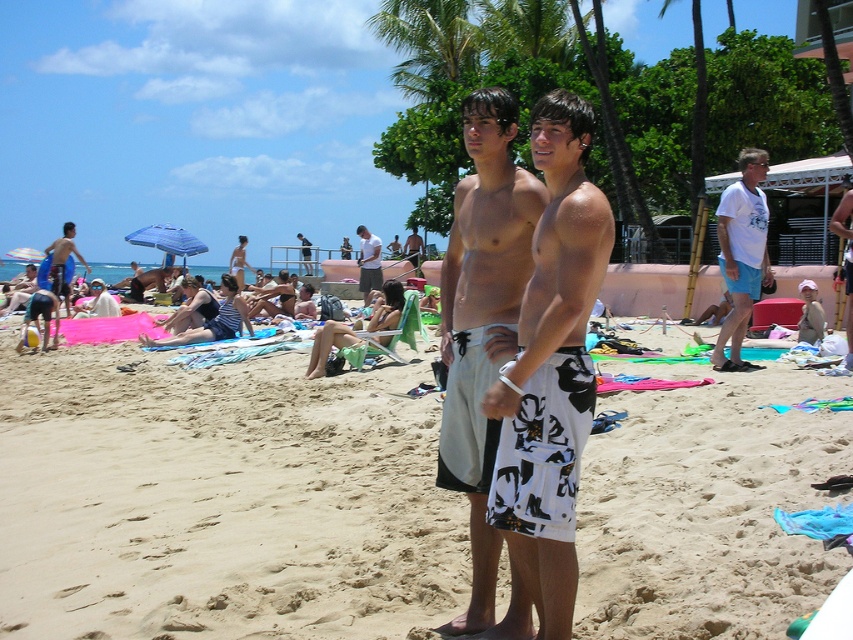
Between point (486, 323) and point (369, 240), which one is positioned in front?

Point (486, 323) is in front.

Can you confirm if white textured boardshorts at center is positioned below white cotton shirt at center?

Indeed, white textured boardshorts at center is positioned under white cotton shirt at center.

Does point (456, 381) come farther from viewer compared to point (372, 257)?

No, it is not.

The width and height of the screenshot is (853, 640). Find the location of `white textured boardshorts at center`. white textured boardshorts at center is located at coordinates (483, 336).

This screenshot has width=853, height=640. What do you see at coordinates (219, 499) in the screenshot? I see `white printed shorts at center` at bounding box center [219, 499].

Between white printed shorts at center and matte black surfboard at left, which one has more height?

matte black surfboard at left is taller.

Identify the location of white printed shorts at center. Image resolution: width=853 pixels, height=640 pixels. (219, 499).

Locate an element on the screen. The height and width of the screenshot is (640, 853). white printed shorts at center is located at coordinates (219, 499).

Between white textured boardshorts at center and smooth tan skin at center, which one is positioned lower?

white textured boardshorts at center

Does white textured boardshorts at center have a greater width compared to smooth tan skin at center?

Yes, white textured boardshorts at center is wider than smooth tan skin at center.

The width and height of the screenshot is (853, 640). Describe the element at coordinates (483, 336) in the screenshot. I see `white textured boardshorts at center` at that location.

Image resolution: width=853 pixels, height=640 pixels. In order to click on white textured boardshorts at center in this screenshot , I will do `click(483, 336)`.